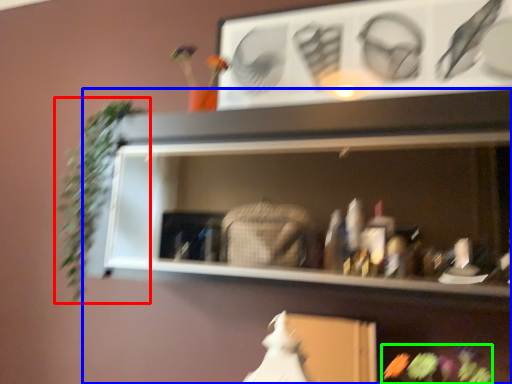
Question: Based on their relative distances, which object is nearer to plant (highlighted by a red box)? Choose from shelf (highlighted by a blue box) and flower (highlighted by a green box).

Choices:
 (A) shelf
 (B) flower

Answer: (A)